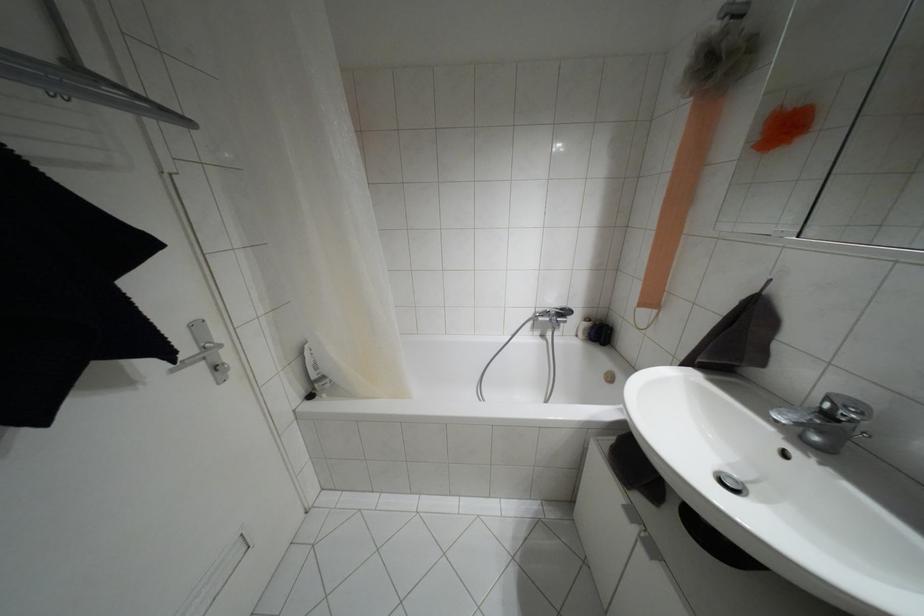
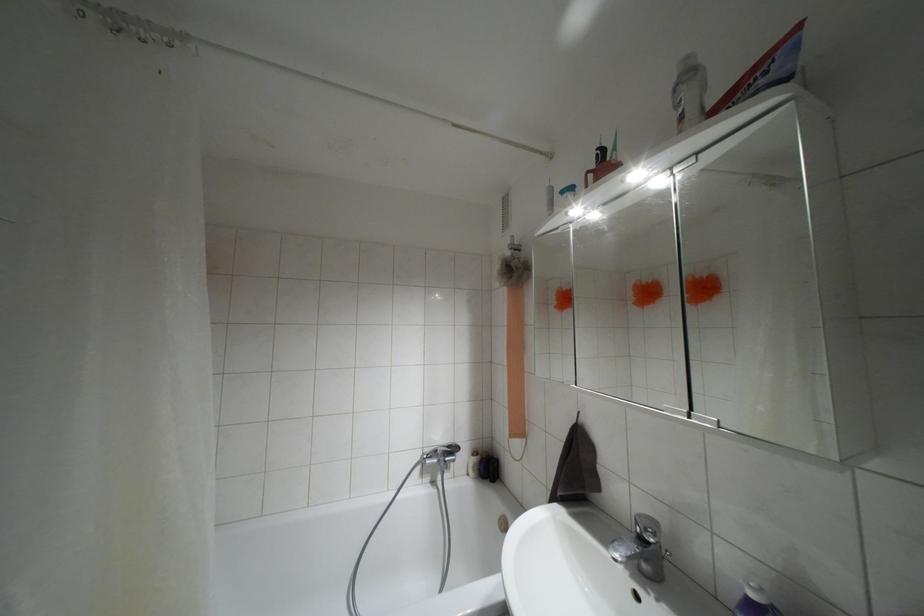
Where in the second image is the point corresponding to (x=825, y=414) from the first image?

(641, 538)